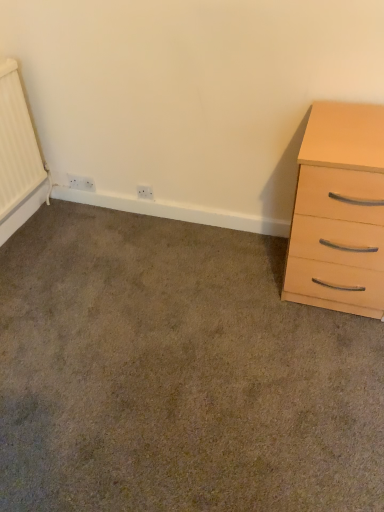
Question: Which direction should I rotate to face white plastic electric outlet at center, the 2th electric outlet from the back, — up or down?

Choices:
 (A) up
 (B) down

Answer: (A)

Question: Considering the relative sizes of white plastic electric outlet at center, which appears as the second electric outlet when viewed from the left, and white plastic electric outlet at lower left, which is the 1th electric outlet from left to right, in the image provided, is white plastic electric outlet at center, which appears as the second electric outlet when viewed from the left, smaller than white plastic electric outlet at lower left, which is the 1th electric outlet from left to right,?

Choices:
 (A) yes
 (B) no

Answer: (A)

Question: Considering the relative sizes of white plastic electric outlet at center, which appears as the second electric outlet when viewed from the left, and white plastic electric outlet at lower left, which appears as the 1th electric outlet when viewed from the back, in the image provided, is white plastic electric outlet at center, which appears as the second electric outlet when viewed from the left, thinner than white plastic electric outlet at lower left, which appears as the 1th electric outlet when viewed from the back,?

Choices:
 (A) yes
 (B) no

Answer: (B)

Question: Does white plastic electric outlet at center, which appears as the second electric outlet when viewed from the left, appear on the right side of white plastic electric outlet at lower left, acting as the second electric outlet starting from the right?

Choices:
 (A) yes
 (B) no

Answer: (A)

Question: Would you say white plastic electric outlet at center, the 1th electric outlet viewed from the front, is a long distance from white plastic electric outlet at lower left, which appears as the 1th electric outlet when viewed from the back?

Choices:
 (A) yes
 (B) no

Answer: (B)

Question: Is white plastic electric outlet at center, the 2th electric outlet from the back, placed right next to white plastic electric outlet at lower left, the 2th electric outlet positioned from the front?

Choices:
 (A) yes
 (B) no

Answer: (B)

Question: Can you confirm if white plastic electric outlet at center, which appears as the second electric outlet when viewed from the left, is taller than white plastic electric outlet at lower left, which appears as the 1th electric outlet when viewed from the back?

Choices:
 (A) no
 (B) yes

Answer: (A)

Question: Is white plastic electric outlet at lower left, which appears as the 1th electric outlet when viewed from the back, next to light wood/veneer chest of drawers at right?

Choices:
 (A) yes
 (B) no

Answer: (B)

Question: Is white plastic electric outlet at lower left, acting as the second electric outlet starting from the right, positioned far away from light wood/veneer chest of drawers at right?

Choices:
 (A) yes
 (B) no

Answer: (A)

Question: Does white plastic electric outlet at lower left, which appears as the 1th electric outlet when viewed from the back, lie behind light wood/veneer chest of drawers at right?

Choices:
 (A) no
 (B) yes

Answer: (B)

Question: Can you confirm if white plastic electric outlet at lower left, acting as the second electric outlet starting from the right, is thinner than light wood/veneer chest of drawers at right?

Choices:
 (A) yes
 (B) no

Answer: (A)

Question: Considering the relative sizes of white plastic electric outlet at lower left, which is the 1th electric outlet from left to right, and light wood/veneer chest of drawers at right in the image provided, is white plastic electric outlet at lower left, which is the 1th electric outlet from left to right, smaller than light wood/veneer chest of drawers at right?

Choices:
 (A) no
 (B) yes

Answer: (B)

Question: From the image's perspective, is white plastic electric outlet at lower left, which is the 1th electric outlet from left to right, located beneath light wood/veneer chest of drawers at right?

Choices:
 (A) yes
 (B) no

Answer: (B)

Question: Considering the relative sizes of white plastic electric outlet at center, the 1th electric outlet viewed from the front, and carpet at lower left in the image provided, is white plastic electric outlet at center, the 1th electric outlet viewed from the front, wider than carpet at lower left?

Choices:
 (A) no
 (B) yes

Answer: (A)